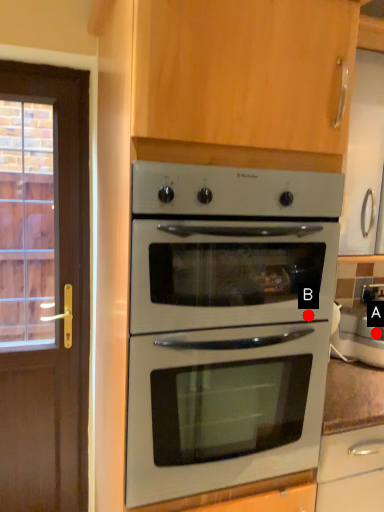
Question: Two points are circled on the image, labeled by A and B beside each circle. Which point is closer to the camera?

Choices:
 (A) A is closer
 (B) B is closer

Answer: (B)